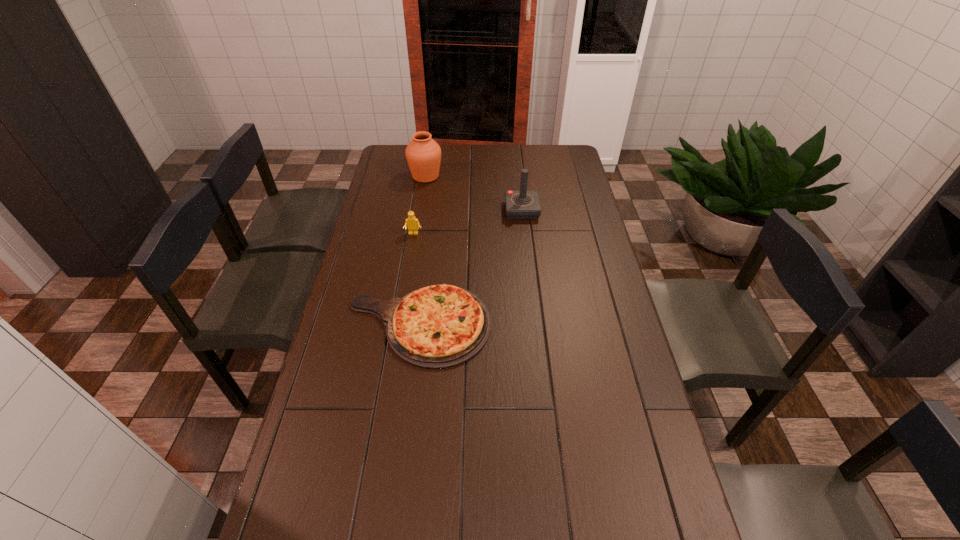
Select which object appears as the third closest to the urn. Please provide its 2D coordinates. Your answer should be formatted as a tuple, i.e. [(x, y)], where the tuple contains the x and y coordinates of a point satisfying the conditions above.

[(440, 326)]

The image size is (960, 540). I want to click on vacant region that satisfies the following two spatial constraints: 1. on the face of the third farthest object; 2. on the right side of the nearest object, so click(398, 325).

At what (x,y) coordinates should I click in order to perform the action: click on free spot that satisfies the following two spatial constraints: 1. on the face of the second shortest object; 2. on the right side of the shortest object. Please return your answer as a coordinate pair (x, y). Looking at the image, I should click on (398, 325).